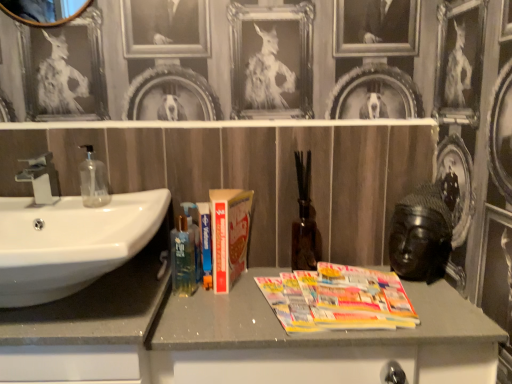
This screenshot has height=384, width=512. I want to click on vacant region to the right of multicolored glossy magazines at center, so click(x=438, y=308).